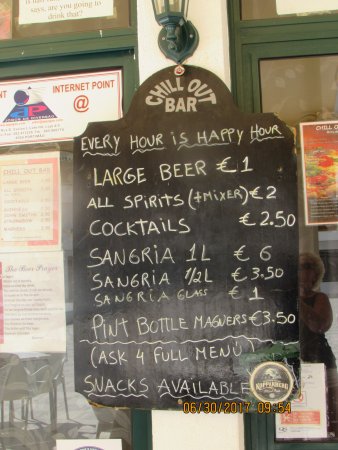
Where is `windows`? This screenshot has width=338, height=450. windows is located at coordinates (328, 280), (59, 381).